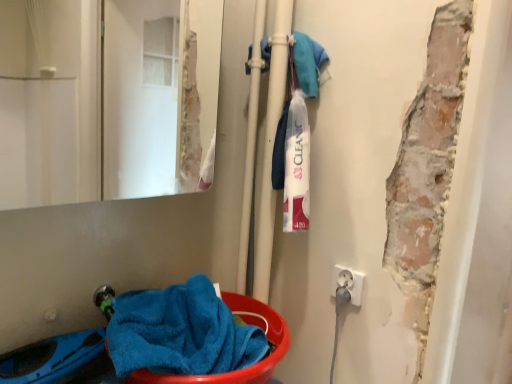
What do you see at coordinates (348, 283) in the screenshot?
I see `white plastic electrical outlet at lower right` at bounding box center [348, 283].

Where is `matte glass mirror at upper left`? matte glass mirror at upper left is located at coordinates (106, 99).

Is white plastic electrical outlet at lower right positioned far away from matte glass mirror at upper left?

Absolutely, white plastic electrical outlet at lower right is distant from matte glass mirror at upper left.

Is white plastic electrical outlet at lower right at the right side of matte glass mirror at upper left?

Yes.

Does white plastic electrical outlet at lower right have a larger size compared to matte glass mirror at upper left?

Incorrect, white plastic electrical outlet at lower right is not larger than matte glass mirror at upper left.

Is white plastic electrical outlet at lower right completely or partially outside of matte glass mirror at upper left?

Yes, white plastic electrical outlet at lower right is located beyond the bounds of matte glass mirror at upper left.

From the image's perspective, is white plastic electrical outlet at lower right positioned above or below blue soft towel at lower left?

From the image's perspective, white plastic electrical outlet at lower right appears above blue soft towel at lower left.

Between white plastic electrical outlet at lower right and blue soft towel at lower left, which one appears on the left side from the viewer's perspective?

From the viewer's perspective, blue soft towel at lower left appears more on the left side.

From a real-world perspective, is white plastic electrical outlet at lower right physically located above or below blue soft towel at lower left?

white plastic electrical outlet at lower right is above blue soft towel at lower left.

Looking at their sizes, would you say blue soft towel at lower left is wider or thinner than matte glass mirror at upper left?

In the image, blue soft towel at lower left appears to be wider than matte glass mirror at upper left.

Does blue soft towel at lower left turn towards matte glass mirror at upper left?

No, blue soft towel at lower left does not turn towards matte glass mirror at upper left.

In the scene shown: Is blue soft towel at lower left surrounding matte glass mirror at upper left?

No, matte glass mirror at upper left is located outside of blue soft towel at lower left.

Locate an element on the screen. This screenshot has height=384, width=512. towel behind the matte glass mirror at upper left is located at coordinates (180, 332).

Is blue soft towel at lower left inside the boundaries of white plastic electrical outlet at lower right, or outside?

blue soft towel at lower left is outside white plastic electrical outlet at lower right.

From the picture: Which is behind, blue soft towel at lower left or white plastic electrical outlet at lower right?

white plastic electrical outlet at lower right is further away from the camera.

Is blue soft towel at lower left far away from white plastic electrical outlet at lower right?

blue soft towel at lower left is near white plastic electrical outlet at lower right, not far away.

Is blue soft towel at lower left bigger than white plastic electrical outlet at lower right?

Yes, blue soft towel at lower left is bigger than white plastic electrical outlet at lower right.

Could blue soft towel at lower left be considered to be inside matte glass mirror at upper left?

No, matte glass mirror at upper left does not contain blue soft towel at lower left.

Is matte glass mirror at upper left far away from blue soft towel at lower left?

Yes, matte glass mirror at upper left is far from blue soft towel at lower left.

In the image, is matte glass mirror at upper left on the left side or the right side of blue soft towel at lower left?

In the image, matte glass mirror at upper left appears on the left side of blue soft towel at lower left.

The width and height of the screenshot is (512, 384). I want to click on mirror on the left of blue soft towel at lower left, so click(x=106, y=99).

From a real-world perspective, between matte glass mirror at upper left and white plastic electrical outlet at lower right, who is vertically lower?

In real-world perspective, white plastic electrical outlet at lower right is lower.

Is matte glass mirror at upper left oriented away from white plastic electrical outlet at lower right?

No, matte glass mirror at upper left is not facing the opposite direction of white plastic electrical outlet at lower right.

In order to click on electric outlet behind the matte glass mirror at upper left in this screenshot , I will do `click(348, 283)`.

Is matte glass mirror at upper left inside the boundaries of white plastic electrical outlet at lower right, or outside?

matte glass mirror at upper left lies outside white plastic electrical outlet at lower right.

Where is `mirror above the white plastic electrical outlet at lower right (from a real-world perspective)`? mirror above the white plastic electrical outlet at lower right (from a real-world perspective) is located at coordinates (106, 99).

In order to click on towel below the white plastic electrical outlet at lower right (from the image's perspective) in this screenshot , I will do `click(180, 332)`.

Estimate the real-world distances between objects in this image. Which object is closer to blue soft towel at lower left, white plastic electrical outlet at lower right or matte glass mirror at upper left?

white plastic electrical outlet at lower right.

Which object lies nearer to the anchor point blue soft towel at lower left, matte glass mirror at upper left or white plastic electrical outlet at lower right?

The object closer to blue soft towel at lower left is white plastic electrical outlet at lower right.

Which object lies further to the anchor point matte glass mirror at upper left, blue soft towel at lower left or white plastic electrical outlet at lower right?

white plastic electrical outlet at lower right is positioned further to the anchor matte glass mirror at upper left.

Considering their positions, is blue soft towel at lower left positioned closer to white plastic electrical outlet at lower right than matte glass mirror at upper left?

Among the two, blue soft towel at lower left is located nearer to white plastic electrical outlet at lower right.

Which object lies further to the anchor point white plastic electrical outlet at lower right, matte glass mirror at upper left or blue soft towel at lower left?

matte glass mirror at upper left is further to white plastic electrical outlet at lower right.

From the image, which object appears to be nearer to matte glass mirror at upper left, white plastic electrical outlet at lower right or blue soft towel at lower left?

blue soft towel at lower left is closer to matte glass mirror at upper left.

This screenshot has width=512, height=384. In order to click on electric outlet between matte glass mirror at upper left and blue soft towel at lower left in the vertical direction in this screenshot , I will do `click(348, 283)`.